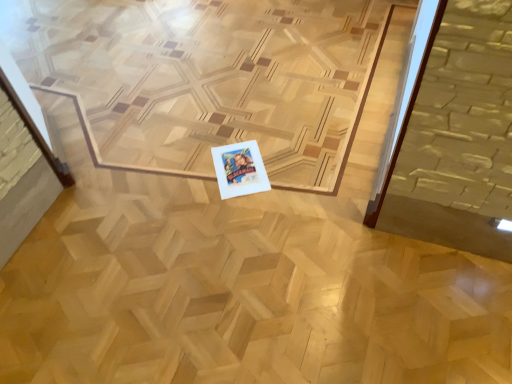
This screenshot has width=512, height=384. Identify the location of free spot above white paper at center (from a real-world perspective). (234, 162).